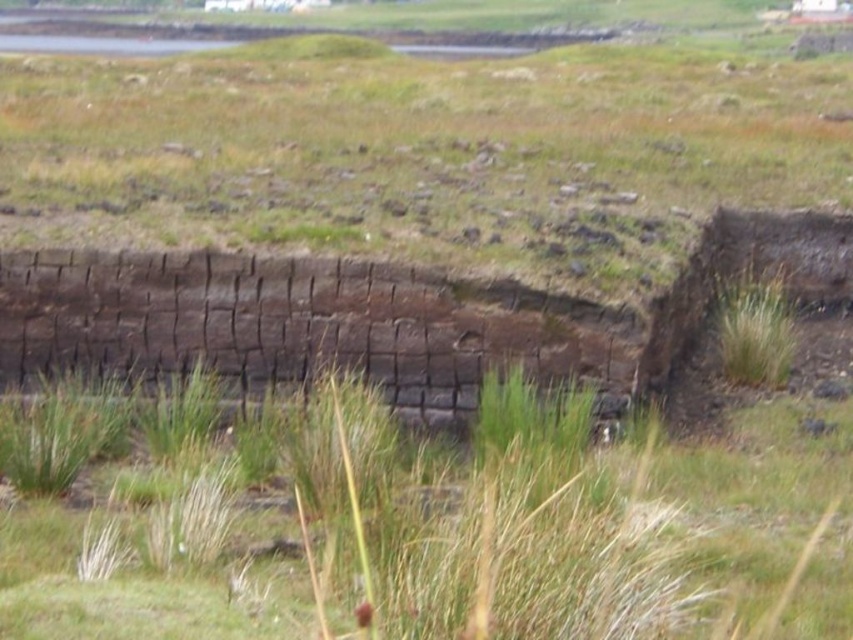
Looking at this image, you are a hiker standing at the edge of the grassy field. You see the green grassy at center and the brown stone wall at center. Which object is located lower in the image?

The green grassy at center is located lower in the image as it is positioned below the brown stone wall at center.

Based on the photo, you are a gardener planning to plant flowers between the green grassy at center and the brown stone wall at center. Which area has more space available for planting?

The green grassy at center has more space available for planting since its width surpasses that of the brown stone wall at center.

You are standing at the point closer to the wall in the image. Which point are you at, point [497,636] or point [476,378]?

Point [497,636] is in front of point [476,378], so if you are standing closer to the wall, you are at point [497,636].